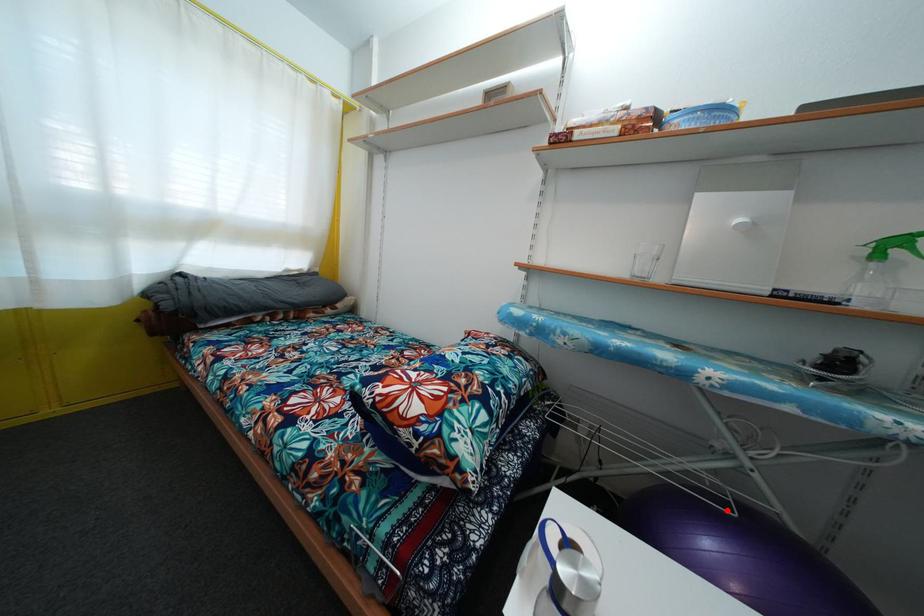
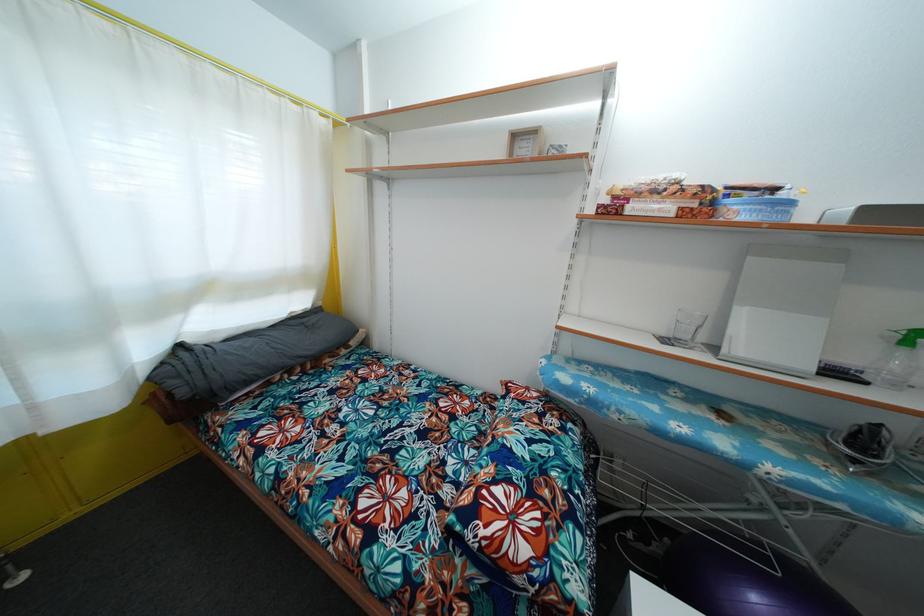
Where in the second image is the point corresponding to the highlighted location from the first image?

(771, 567)